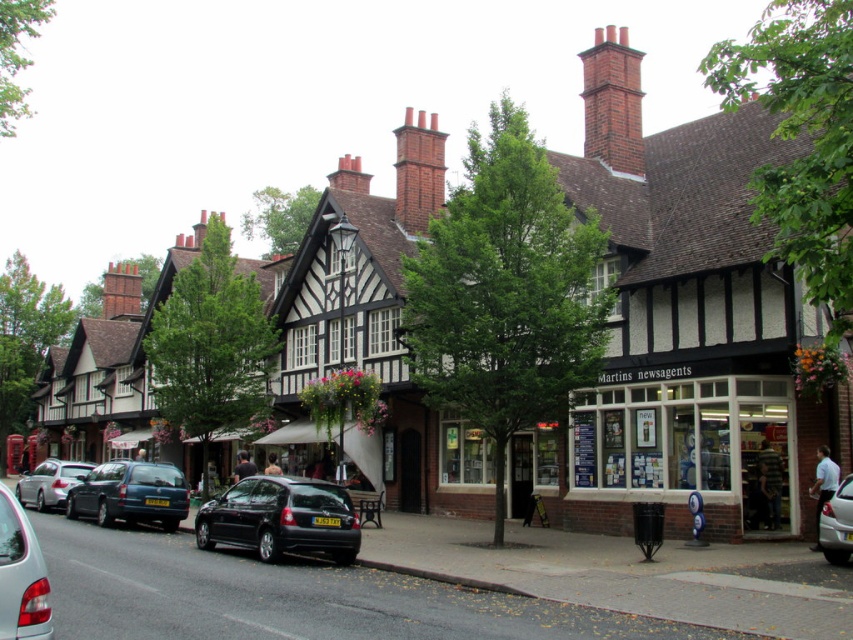
You are a delivery person who needs to park your van in front of the white glass storefront at center. However, there is a metallic blue sedan at center blocking the parking spot. Can you drive around the sedan to reach the storefront?

The white glass storefront at center is positioned over the metallic blue sedan at center, meaning the sedan is parked directly in front of the storefront. Since the sedan is blocking the storefront, you cannot drive around it to reach the storefront as it is directly in the way.